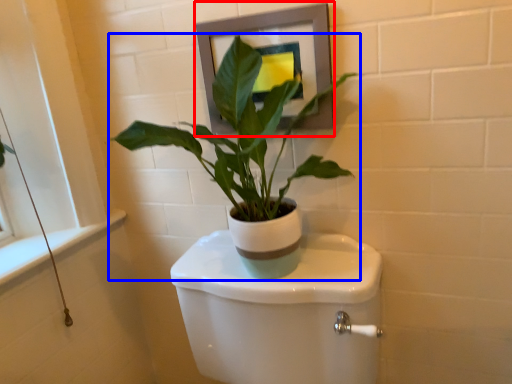
Question: Which object appears closest to the camera in this image, picture frame (highlighted by a red box) or houseplant (highlighted by a blue box)?

Choices:
 (A) picture frame
 (B) houseplant

Answer: (B)